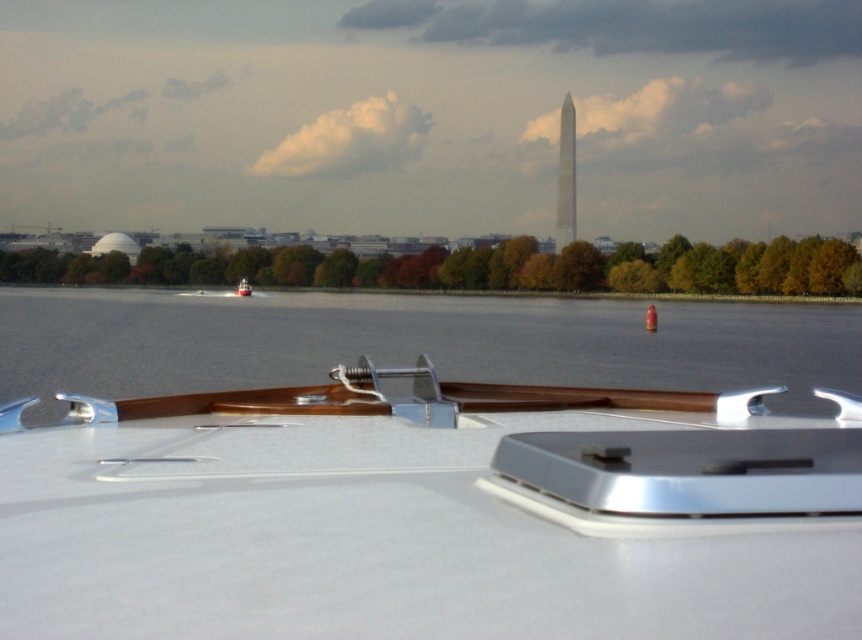
Between clear water at center and smooth stone tower at center, which one appears on the right side from the viewer's perspective?

Positioned to the right is smooth stone tower at center.

Find the location of a particular element. This screenshot has height=640, width=862. clear water at center is located at coordinates (411, 342).

Which is in front, point (581, 365) or point (565, 172)?

Point (581, 365) is more forward.

This screenshot has height=640, width=862. In order to click on clear water at center in this screenshot , I will do (411, 342).

Which of these two, white glossy boat at center or smooth stone tower at center, stands shorter?

Standing shorter between the two is white glossy boat at center.

Does white glossy boat at center have a lesser height compared to smooth stone tower at center?

Indeed, white glossy boat at center has a lesser height compared to smooth stone tower at center.

Does point (484, 547) come closer to viewer compared to point (558, 177)?

Yes, point (484, 547) is in front of point (558, 177).

Identify the location of white glossy boat at center. (431, 513).

Between white glossy boat at center and clear water at center, which one appears on the right side from the viewer's perspective?

clear water at center

Which is behind, point (536, 426) or point (122, 324)?

Point (122, 324)

Between point (109, 604) and point (570, 372), which one is positioned in front?

Point (109, 604) is in front.

The height and width of the screenshot is (640, 862). What are the coordinates of `white glossy boat at center` in the screenshot? It's located at [431, 513].